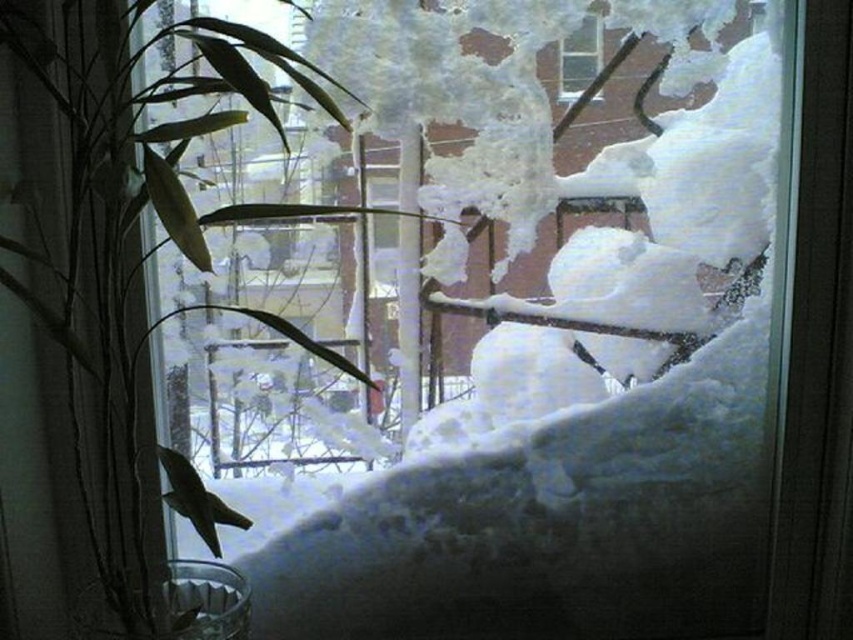
Looking at this image, can you confirm if green leafy plant at left is positioned above clear glass window at upper center?

No.

Does green leafy plant at left appear under clear glass window at upper center?

Yes, green leafy plant at left is below clear glass window at upper center.

Is point (15, 372) positioned in front of point (585, 29)?

Yes, it is in front of point (585, 29).

Where is `green leafy plant at left`? The height and width of the screenshot is (640, 853). green leafy plant at left is located at coordinates (109, 262).